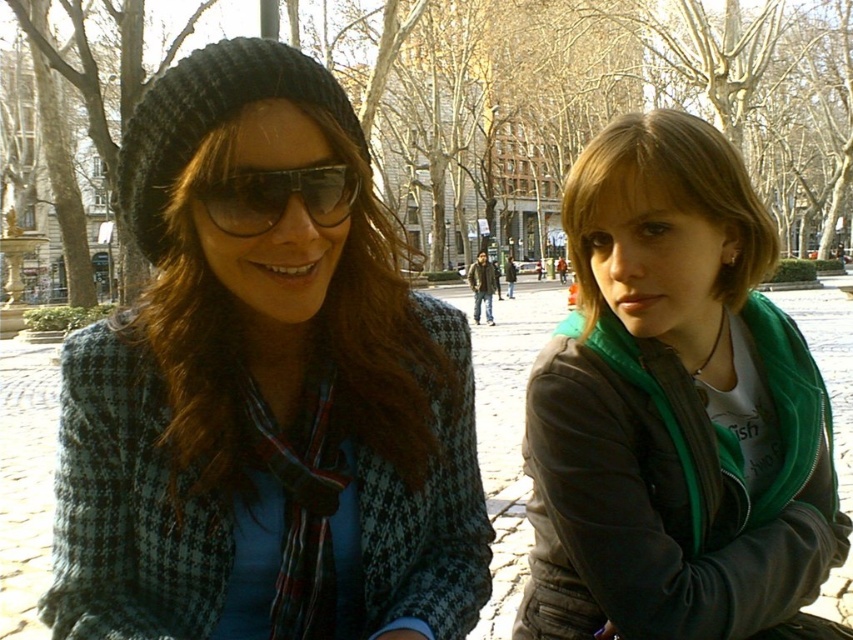
Consider the image. You are standing in a public square and see the houndstooth fabric coat at center. If you want to take a closer look at the coat without moving, which direction should you look?

You should look toward the center of the scene where the houndstooth fabric coat is located, as it is 4.15 meters away from your current position.

You are a photographer trying to capture a closeup of the green matte scarf at center and the black reflective sunglasses at center. Since you want to focus on one object, which one would you choose to zoom in on to ensure it fills the frame without cropping?

The green matte scarf at center is larger in size than the black reflective sunglasses at center, so you should zoom in on the green matte scarf at center to ensure it fills the frame without cropping.

You are a photographer trying to capture a closeup of the black reflective sunglasses at center without the houndstooth fabric coat at center blocking the view. Can you fit the sunglasses into your camera frame if the coat is currently overlapping them?

The houndstooth fabric coat at center is bigger than black reflective sunglasses at center. Since the coat is larger and overlapping, adjusting the camera angle might be necessary to avoid the coat blocking the sunglasses.